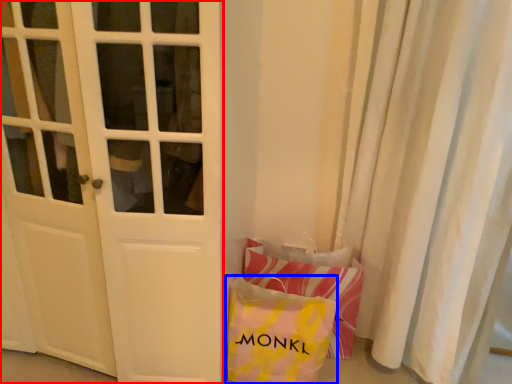
Question: Which object appears closest to the camera in this image, door (highlighted by a red box) or pouch (highlighted by a blue box)?

Choices:
 (A) door
 (B) pouch

Answer: (A)